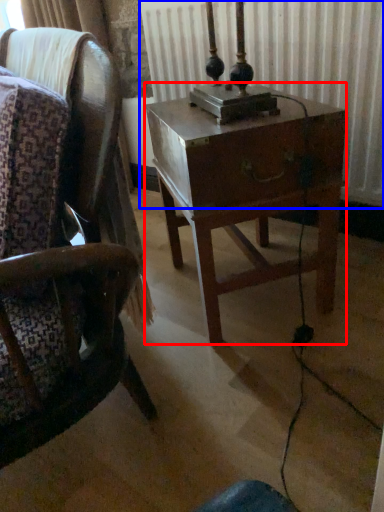
Question: Which object appears closest to the camera in this image, nightstand (highlighted by a red box) or radiator (highlighted by a blue box)?

Choices:
 (A) nightstand
 (B) radiator

Answer: (A)